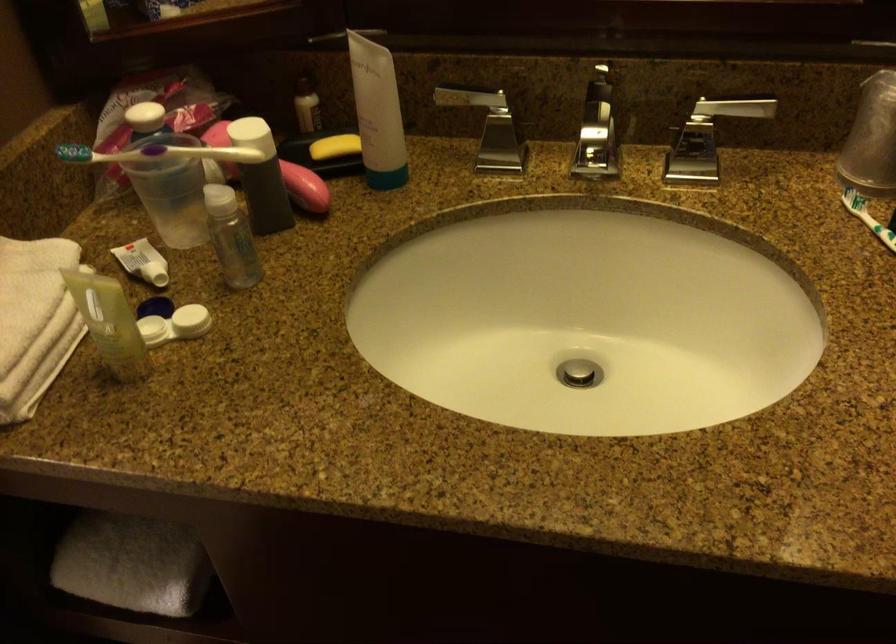
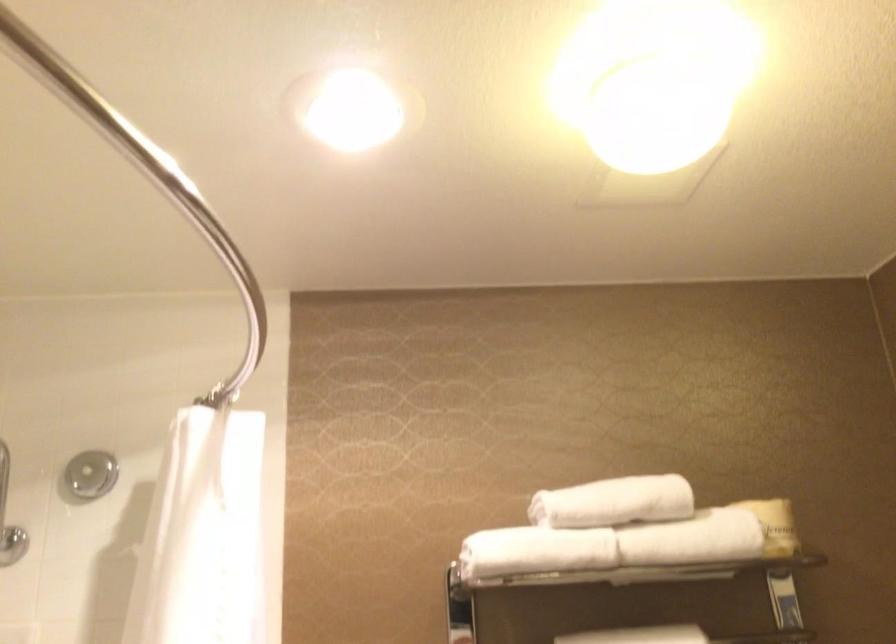
The first image is from the beginning of the video and the second image is from the end. How did the camera likely rotate when shooting the video?

The camera's rotation is toward left-up.